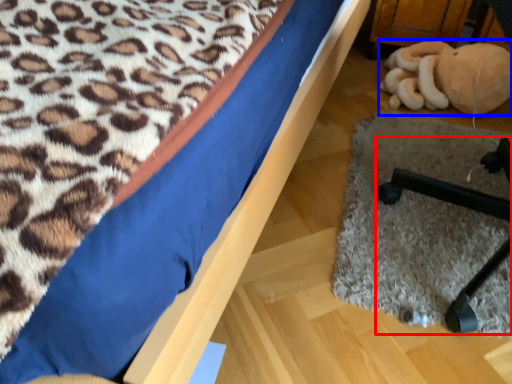
Question: Which point is closer to the camera, furniture (highlighted by a red box) or toy (highlighted by a blue box)?

Choices:
 (A) furniture
 (B) toy

Answer: (A)